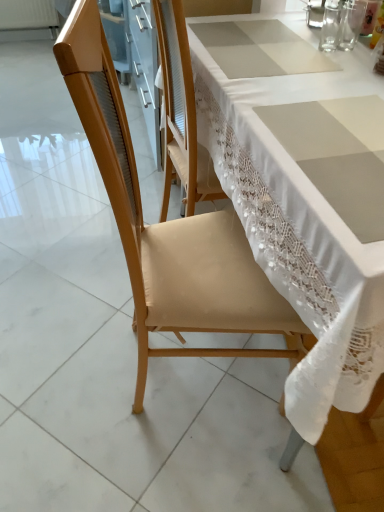
What do you see at coordinates (331, 25) in the screenshot?
I see `transparent glass at upper right, the 2th tableware positioned from the left` at bounding box center [331, 25].

This screenshot has width=384, height=512. Describe the element at coordinates (315, 13) in the screenshot. I see `clear glass at upper right, acting as the first tableware starting from the left` at that location.

Image resolution: width=384 pixels, height=512 pixels. I want to click on transparent glass at upper right, arranged as the 2th tableware when viewed from the right, so click(331, 25).

Locate an element on the screen. This screenshot has width=384, height=512. tableware that is the 2nd one below the clear glass at upper right, which appears as the 3th tableware when viewed from the right (from a real-world perspective) is located at coordinates (331, 25).

Is transparent glass at upper right, arranged as the 2th tableware when viewed from the right, a part of clear glass at upper right, which appears as the 3th tableware when viewed from the right?

No, transparent glass at upper right, arranged as the 2th tableware when viewed from the right, is not surrounded by clear glass at upper right, which appears as the 3th tableware when viewed from the right.

How far apart are clear glass at upper right, which appears as the 3th tableware when viewed from the right, and transparent glass at upper right, the 2th tableware positioned from the left?

1.92 inches.

From a real-world perspective, is clear glass at upper right, acting as the first tableware starting from the left, on top of transparent glass at upper right, arranged as the 2th tableware when viewed from the right?

Yes, from a real-world perspective, clear glass at upper right, acting as the first tableware starting from the left, is on top of transparent glass at upper right, arranged as the 2th tableware when viewed from the right.

Considering the sizes of objects transparent glass at upper right, the 1th tableware from the right, and transparent glass at upper right, arranged as the 2th tableware when viewed from the right, in the image provided, who is shorter, transparent glass at upper right, the 1th tableware from the right, or transparent glass at upper right, arranged as the 2th tableware when viewed from the right,?

transparent glass at upper right, arranged as the 2th tableware when viewed from the right, is shorter.

From the picture: Which is closer, [342,37] or [328,6]?

Point [342,37] is closer to the camera than point [328,6].

Does transparent glass at upper right, marked as the 3th tableware in a left-to-right arrangement, contain transparent glass at upper right, the 2th tableware positioned from the left?

Actually, transparent glass at upper right, the 2th tableware positioned from the left, is outside transparent glass at upper right, marked as the 3th tableware in a left-to-right arrangement.

Are transparent glass at upper right, the 1th tableware from the right, and transparent glass at upper right, arranged as the 2th tableware when viewed from the right, located far from each other?

No.

What's the angular difference between transparent glass at upper right, marked as the 3th tableware in a left-to-right arrangement, and clear glass at upper right, which appears as the 3th tableware when viewed from the right,'s facing directions?

The angular difference between transparent glass at upper right, marked as the 3th tableware in a left-to-right arrangement, and clear glass at upper right, which appears as the 3th tableware when viewed from the right, is 0.000665 degrees.

Looking at this image, is the depth of transparent glass at upper right, marked as the 3th tableware in a left-to-right arrangement, greater than that of clear glass at upper right, which appears as the 3th tableware when viewed from the right?

No, it is in front of clear glass at upper right, which appears as the 3th tableware when viewed from the right.

Does transparent glass at upper right, marked as the 3th tableware in a left-to-right arrangement, turn towards clear glass at upper right, which appears as the 3th tableware when viewed from the right?

No, transparent glass at upper right, marked as the 3th tableware in a left-to-right arrangement, is not facing towards clear glass at upper right, which appears as the 3th tableware when viewed from the right.

Would you say transparent glass at upper right, marked as the 3th tableware in a left-to-right arrangement, is outside clear glass at upper right, acting as the first tableware starting from the left?

transparent glass at upper right, marked as the 3th tableware in a left-to-right arrangement, is positioned outside clear glass at upper right, acting as the first tableware starting from the left.

Where is `tableware that is the 2nd object above the transparent glass at upper right, the 2th tableware positioned from the left (from a real-world perspective)`? This screenshot has height=512, width=384. tableware that is the 2nd object above the transparent glass at upper right, the 2th tableware positioned from the left (from a real-world perspective) is located at coordinates (315, 13).

Does point (331, 37) come in front of point (320, 27)?

Yes, it is in front of point (320, 27).

Is transparent glass at upper right, the 2th tableware positioned from the left, to the right of clear glass at upper right, acting as the first tableware starting from the left, from the viewer's perspective?

Indeed, transparent glass at upper right, the 2th tableware positioned from the left, is positioned on the right side of clear glass at upper right, acting as the first tableware starting from the left.

Does transparent glass at upper right, arranged as the 2th tableware when viewed from the right, have a greater height compared to clear glass at upper right, acting as the first tableware starting from the left?

In fact, transparent glass at upper right, arranged as the 2th tableware when viewed from the right, may be shorter than clear glass at upper right, acting as the first tableware starting from the left.

Considering the relative sizes of transparent glass at upper right, the 2th tableware positioned from the left, and transparent glass at upper right, the 1th tableware from the right, in the image provided, is transparent glass at upper right, the 2th tableware positioned from the left, smaller than transparent glass at upper right, the 1th tableware from the right,?

Actually, transparent glass at upper right, the 2th tableware positioned from the left, might be larger than transparent glass at upper right, the 1th tableware from the right.

Which object is closer to the camera, transparent glass at upper right, arranged as the 2th tableware when viewed from the right, or transparent glass at upper right, the 1th tableware from the right?

Positioned in front is transparent glass at upper right, arranged as the 2th tableware when viewed from the right.

Based on the photo, could you tell me if transparent glass at upper right, arranged as the 2th tableware when viewed from the right, is facing transparent glass at upper right, the 1th tableware from the right?

No, transparent glass at upper right, arranged as the 2th tableware when viewed from the right, does not turn towards transparent glass at upper right, the 1th tableware from the right.

Is transparent glass at upper right, the 2th tableware positioned from the left, at the right side of transparent glass at upper right, marked as the 3th tableware in a left-to-right arrangement?

In fact, transparent glass at upper right, the 2th tableware positioned from the left, is to the left of transparent glass at upper right, marked as the 3th tableware in a left-to-right arrangement.

Considering the relative positions of clear glass at upper right, which appears as the 3th tableware when viewed from the right, and transparent glass at upper right, the 1th tableware from the right, in the image provided, is clear glass at upper right, which appears as the 3th tableware when viewed from the right, to the right of transparent glass at upper right, the 1th tableware from the right, from the viewer's perspective?

Incorrect, clear glass at upper right, which appears as the 3th tableware when viewed from the right, is not on the right side of transparent glass at upper right, the 1th tableware from the right.

Does clear glass at upper right, which appears as the 3th tableware when viewed from the right, have a greater height compared to transparent glass at upper right, the 1th tableware from the right?

Correct, clear glass at upper right, which appears as the 3th tableware when viewed from the right, is much taller as transparent glass at upper right, the 1th tableware from the right.

Would you say clear glass at upper right, acting as the first tableware starting from the left, is inside or outside transparent glass at upper right, the 1th tableware from the right?

clear glass at upper right, acting as the first tableware starting from the left, exists outside the volume of transparent glass at upper right, the 1th tableware from the right.

Considering the sizes of objects clear glass at upper right, acting as the first tableware starting from the left, and transparent glass at upper right, marked as the 3th tableware in a left-to-right arrangement, in the image provided, who is smaller, clear glass at upper right, acting as the first tableware starting from the left, or transparent glass at upper right, marked as the 3th tableware in a left-to-right arrangement,?

Smaller between the two is transparent glass at upper right, marked as the 3th tableware in a left-to-right arrangement.

At what (x,y) coordinates should I click in order to perform the action: click on the 2nd tableware below the clear glass at upper right, acting as the first tableware starting from the left (from the image's perspective). Please return your answer as a coordinate pair (x, y). The height and width of the screenshot is (512, 384). Looking at the image, I should click on (331, 25).

Locate an element on the screen. The image size is (384, 512). tableware in front of the transparent glass at upper right, the 1th tableware from the right is located at coordinates (331, 25).

Based on their spatial positions, is clear glass at upper right, acting as the first tableware starting from the left, or transparent glass at upper right, the 1th tableware from the right, further from transparent glass at upper right, the 2th tableware positioned from the left?

clear glass at upper right, acting as the first tableware starting from the left.

Considering their positions, is transparent glass at upper right, the 1th tableware from the right, positioned further to transparent glass at upper right, the 2th tableware positioned from the left, than clear glass at upper right, which appears as the 3th tableware when viewed from the right?

Based on the image, clear glass at upper right, which appears as the 3th tableware when viewed from the right, appears to be further to transparent glass at upper right, the 2th tableware positioned from the left.

Based on their spatial positions, is transparent glass at upper right, the 2th tableware positioned from the left, or transparent glass at upper right, the 1th tableware from the right, further from clear glass at upper right, which appears as the 3th tableware when viewed from the right?

transparent glass at upper right, the 1th tableware from the right, lies further to clear glass at upper right, which appears as the 3th tableware when viewed from the right, than the other object.

From the image, which object appears to be farther from transparent glass at upper right, the 1th tableware from the right, transparent glass at upper right, the 2th tableware positioned from the left, or clear glass at upper right, which appears as the 3th tableware when viewed from the right?

clear glass at upper right, which appears as the 3th tableware when viewed from the right, is further to transparent glass at upper right, the 1th tableware from the right.

Considering their positions, is transparent glass at upper right, the 1th tableware from the right, positioned closer to clear glass at upper right, which appears as the 3th tableware when viewed from the right, than transparent glass at upper right, arranged as the 2th tableware when viewed from the right?

transparent glass at upper right, arranged as the 2th tableware when viewed from the right.

Estimate the real-world distances between objects in this image. Which object is further from transparent glass at upper right, the 1th tableware from the right, clear glass at upper right, which appears as the 3th tableware when viewed from the right, or transparent glass at upper right, the 2th tableware positioned from the left?

clear glass at upper right, which appears as the 3th tableware when viewed from the right, lies further to transparent glass at upper right, the 1th tableware from the right, than the other object.

Image resolution: width=384 pixels, height=512 pixels. Identify the location of tableware between clear glass at upper right, which appears as the 3th tableware when viewed from the right, and transparent glass at upper right, the 1th tableware from the right, in the horizontal direction. (331, 25).